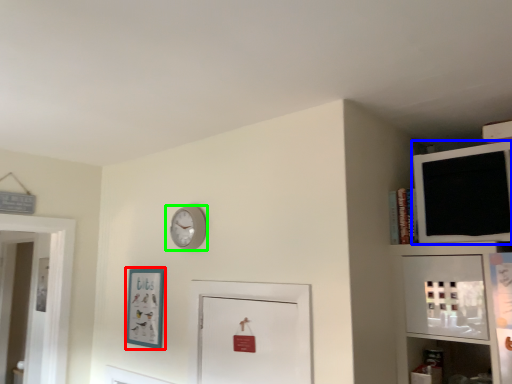
Question: Considering the real-world distances, which object is closest to picture frame (highlighted by a red box)? medicine cabinet (highlighted by a blue box) or wall clock (highlighted by a green box).

Choices:
 (A) medicine cabinet
 (B) wall clock

Answer: (B)